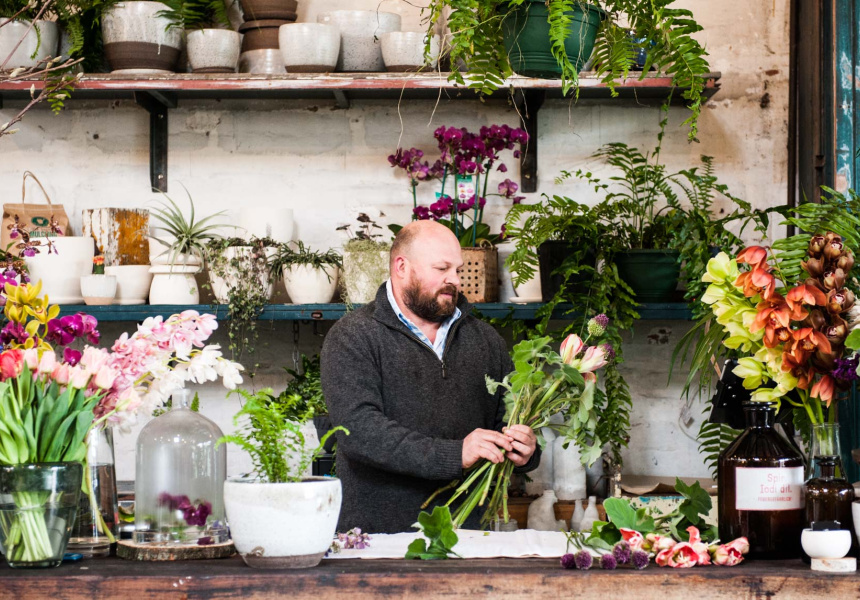
The width and height of the screenshot is (860, 600). Identify the location of brown basket with holes. (487, 275).